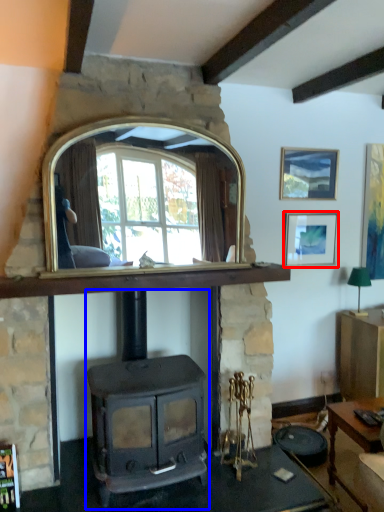
Question: Which of the following is the closest to the observer, picture frame (highlighted by a red box) or wood burning stove (highlighted by a blue box)?

Choices:
 (A) picture frame
 (B) wood burning stove

Answer: (B)